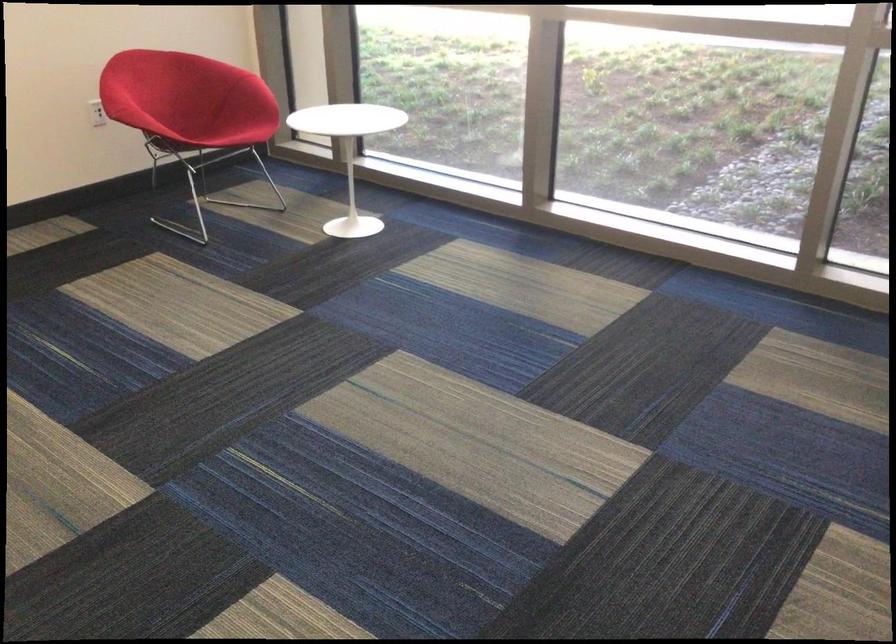
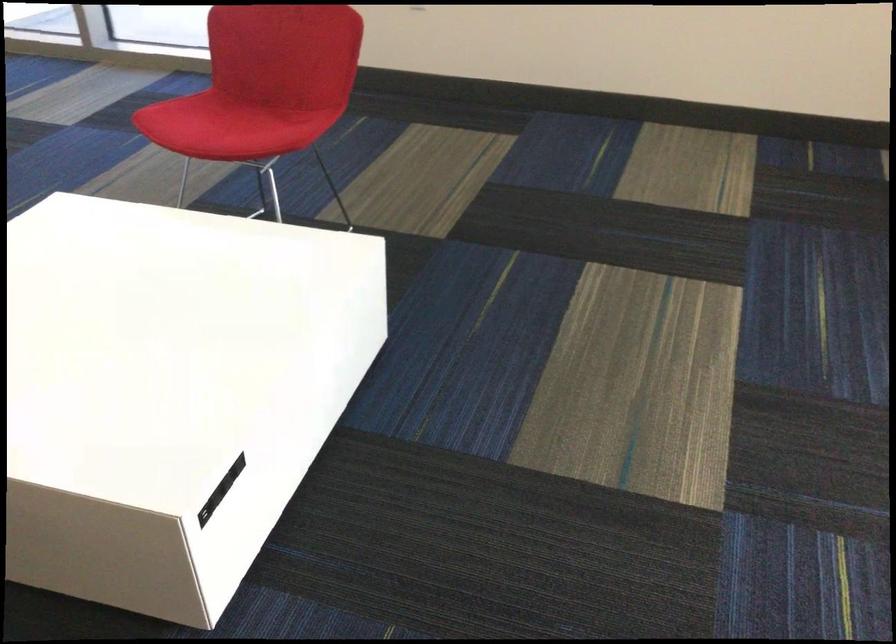
Based on the continuous images, in which direction is the camera rotating?

The camera rotated toward left-down.